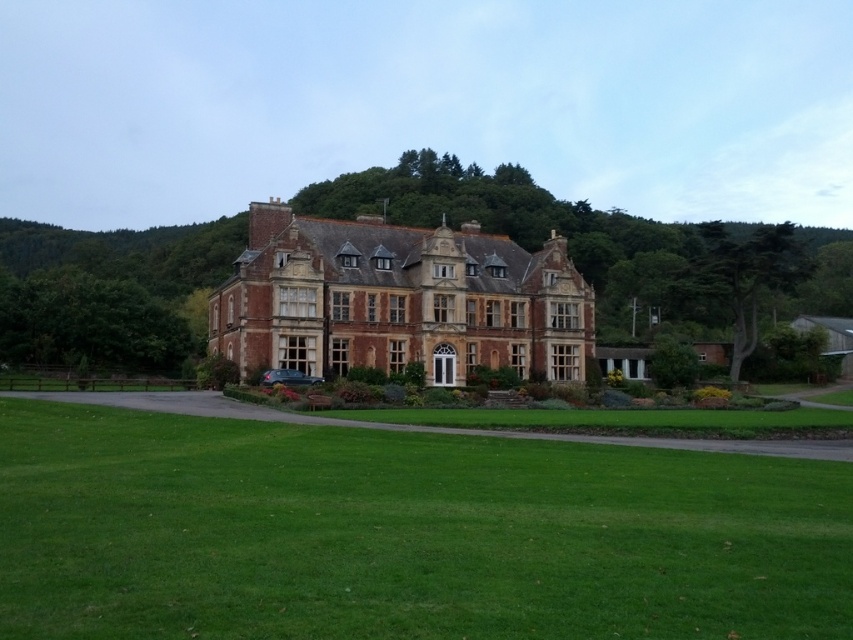
Question: Is green grass at center behind brown brick mansion at center?

Choices:
 (A) no
 (B) yes

Answer: (A)

Question: Which point is farther to the camera?

Choices:
 (A) brown brick mansion at center
 (B) green grass at center

Answer: (A)

Question: Does green grass at center appear over brown brick mansion at center?

Choices:
 (A) no
 (B) yes

Answer: (A)

Question: Which point is farther to the camera?

Choices:
 (A) brown brick mansion at center
 (B) green grass at center

Answer: (A)

Question: Is green grass at center thinner than brown brick mansion at center?

Choices:
 (A) no
 (B) yes

Answer: (A)